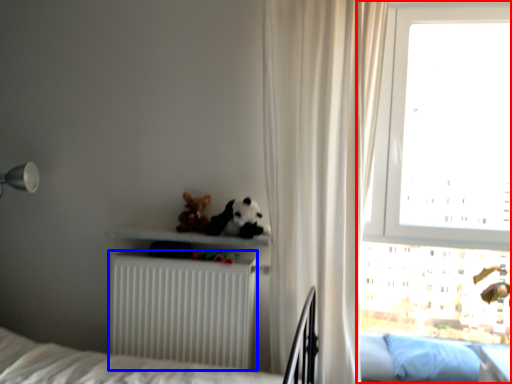
Question: Which of the following is the closest to the observer, window (highlighted by a red box) or radiator (highlighted by a blue box)?

Choices:
 (A) window
 (B) radiator

Answer: (B)